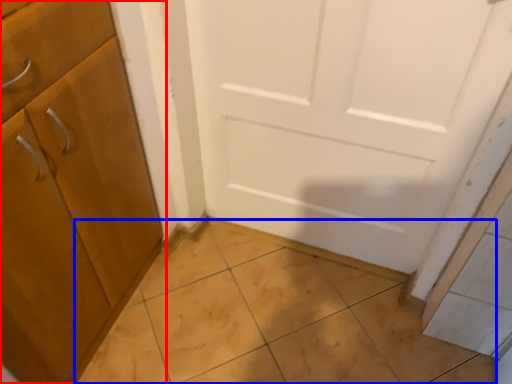
Question: Among these objects, which one is nearest to the camera, cabinetry (highlighted by a red box) or tile (highlighted by a blue box)?

Choices:
 (A) cabinetry
 (B) tile

Answer: (A)